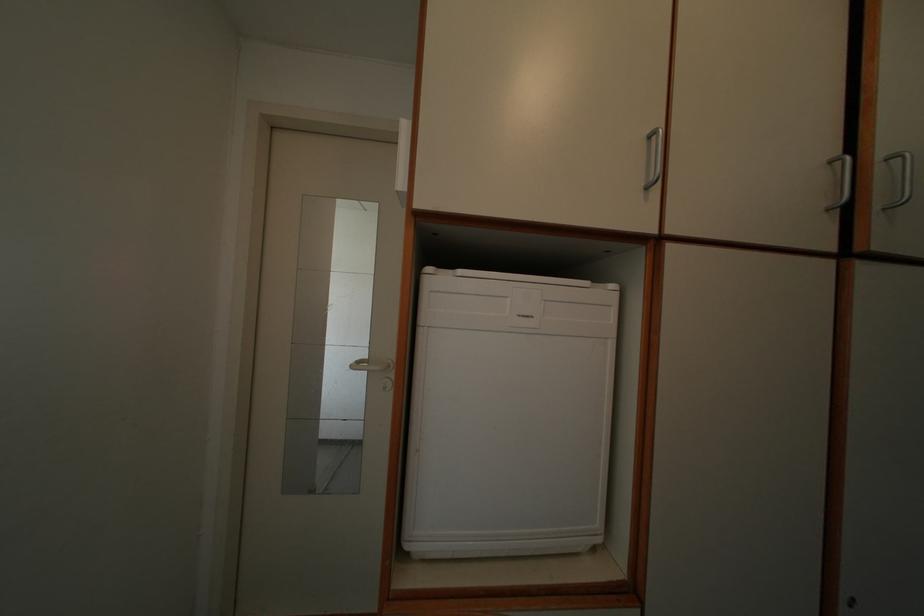
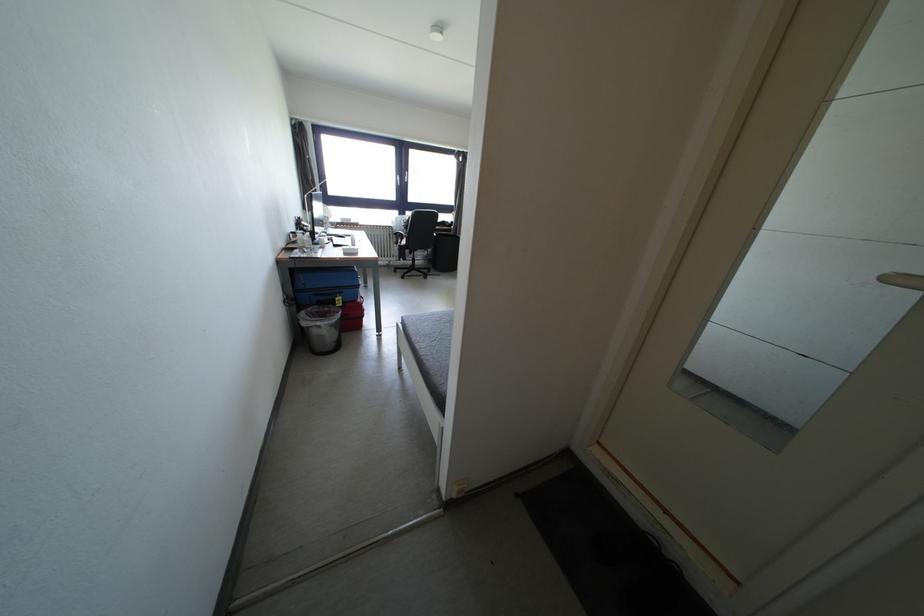
Based on the continuous images, in which direction is the camera rotating?

The rotation direction of the camera is left-down.